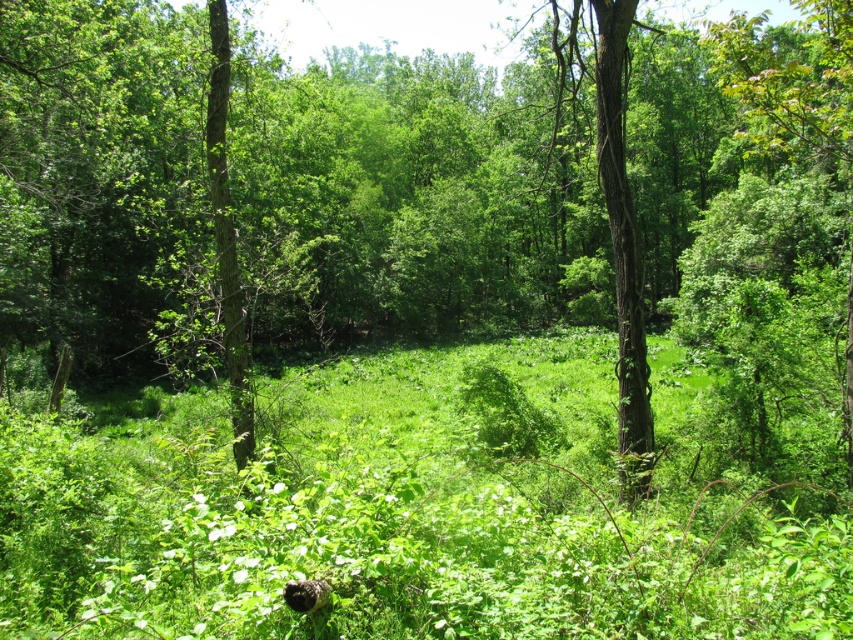
Does green leafy grass at center have a lesser height compared to fluffy black cat at lower center?

Incorrect, green leafy grass at center's height does not fall short of fluffy black cat at lower center's.

Who is more forward, (22, 420) or (303, 611)?

Point (303, 611) is more forward.

Does point (202, 605) come farther from viewer compared to point (306, 588)?

Yes, it is.

Image resolution: width=853 pixels, height=640 pixels. I want to click on green leafy grass at center, so click(422, 506).